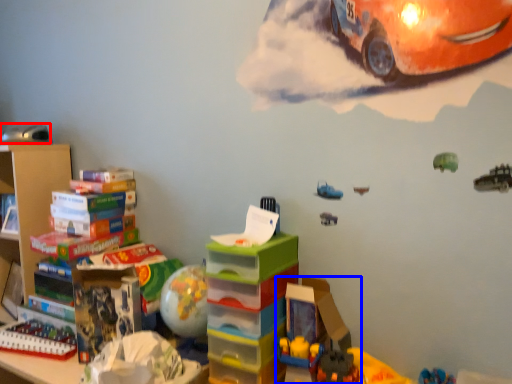
Question: Which object appears farthest to the camera in this image, toy (highlighted by a red box) or toy (highlighted by a blue box)?

Choices:
 (A) toy
 (B) toy

Answer: (A)